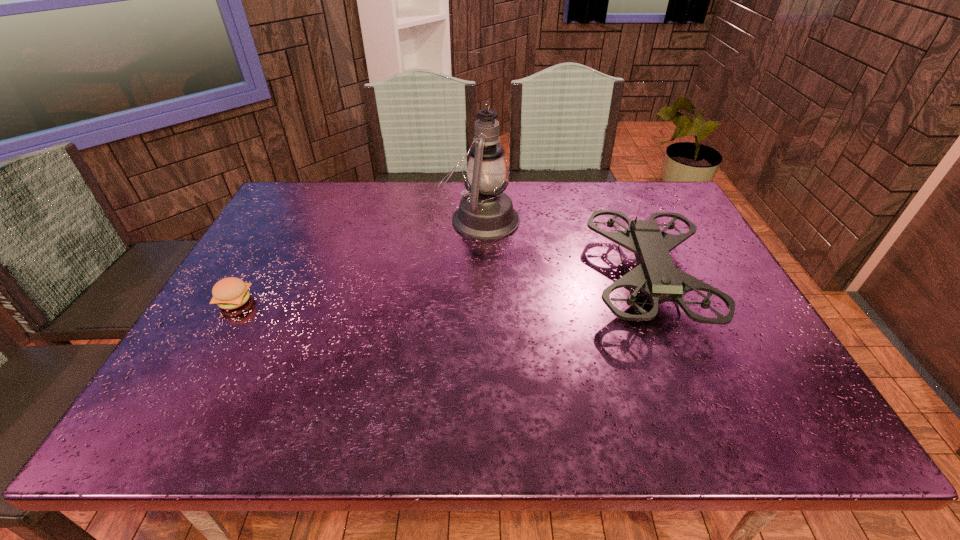
I want to click on the second object from left to right, so click(x=485, y=213).

Where is `the tallest object`? This screenshot has width=960, height=540. the tallest object is located at coordinates (485, 213).

This screenshot has width=960, height=540. I want to click on the rightmost object, so click(x=656, y=276).

Image resolution: width=960 pixels, height=540 pixels. In order to click on drone in this screenshot , I will do `click(656, 276)`.

This screenshot has height=540, width=960. In order to click on hamburger in this screenshot , I will do `click(229, 293)`.

You are a GUI agent. You are given a task and a screenshot of the screen. Output one action in this format:
    pyautogui.click(x=<x>, y=<y>)
    Task: Click on the shortest object
    The image size is (960, 540).
    Given the screenshot: What is the action you would take?
    [229, 293]

Where is `free region located 0.110m on the right of the tallest object`? free region located 0.110m on the right of the tallest object is located at coordinates (555, 219).

You are a GUI agent. You are given a task and a screenshot of the screen. Output one action in this format:
    pyautogui.click(x=<x>, y=<y>)
    Task: Click on the blank space located 0.270m on the back of the rightmost object
    This screenshot has height=540, width=960.
    Given the screenshot: What is the action you would take?
    pyautogui.click(x=608, y=185)

Locate an element on the screen. Image resolution: width=960 pixels, height=540 pixels. vacant space situated on the front of the leftmost object is located at coordinates (212, 340).

You are a GUI agent. You are given a task and a screenshot of the screen. Output one action in this format:
    pyautogui.click(x=<x>, y=<y>)
    Task: Click on the object at the far edge
    Image resolution: width=960 pixels, height=540 pixels.
    Given the screenshot: What is the action you would take?
    pyautogui.click(x=485, y=213)